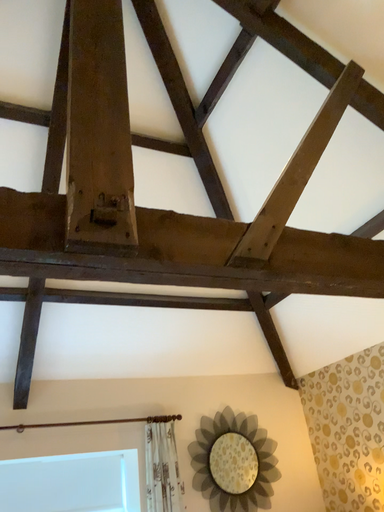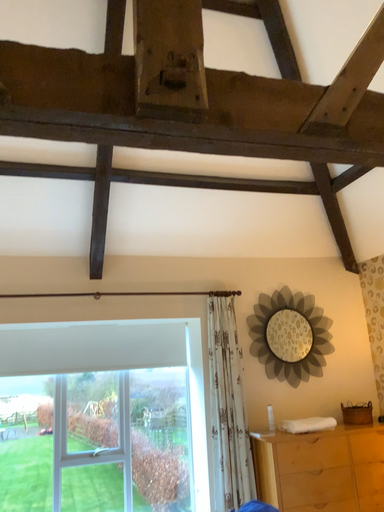
Question: Which way did the camera rotate in the video?

Choices:
 (A) rotated upward
 (B) rotated downward

Answer: (B)